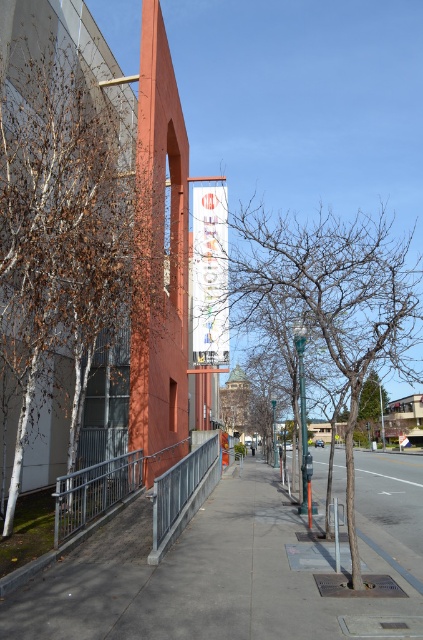
Is point (101, 316) farther from viewer compared to point (302, 477)?

No, (101, 316) is in front of (302, 477).

Which is above, brown bark tree at left or green metallic pole at center?

brown bark tree at left is higher up.

The width and height of the screenshot is (423, 640). Identify the location of brown bark tree at left. (101, 250).

You are a GUI agent. You are given a task and a screenshot of the screen. Output one action in this format:
    pyautogui.click(x=<x>, y=<y>)
    Task: Click on the brown bark tree at left
    The image size is (423, 640).
    Given the screenshot: What is the action you would take?
    pyautogui.click(x=101, y=250)

Which is behind, point (41, 163) or point (189, 468)?

The point (189, 468) is more distant.

Locate an element on the screen. This screenshot has width=423, height=640. brown bark tree at left is located at coordinates (101, 250).

I want to click on brown bark tree at left, so click(x=101, y=250).

Can you confirm if metallic gray railing at lower left is positioned below green metallic street sign at center?

No, metallic gray railing at lower left is not below green metallic street sign at center.

Find the location of `metallic gray railing at lower left`. metallic gray railing at lower left is located at coordinates (106, 486).